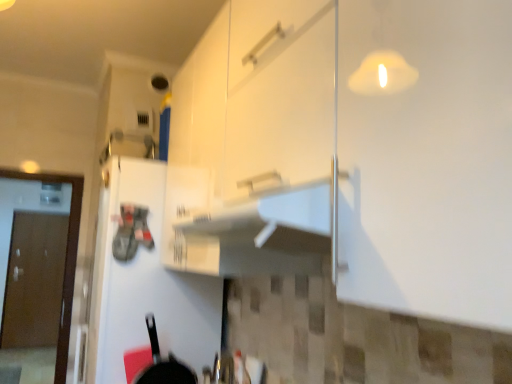
Question: From the image's perspective, is white matte refrigerator at left, the 2th door positioned from the back, on top of black matte frying pan at lower left?

Choices:
 (A) no
 (B) yes

Answer: (B)

Question: Is white matte refrigerator at left, which is the 1th door in front-to-back order, in contact with black matte frying pan at lower left?

Choices:
 (A) yes
 (B) no

Answer: (B)

Question: Considering the relative sizes of white matte refrigerator at left, positioned as the first door in right-to-left order, and black matte frying pan at lower left in the image provided, is white matte refrigerator at left, positioned as the first door in right-to-left order, taller than black matte frying pan at lower left?

Choices:
 (A) no
 (B) yes

Answer: (B)

Question: From the image's perspective, does white matte refrigerator at left, the 2th door positioned from the back, appear lower than black matte frying pan at lower left?

Choices:
 (A) yes
 (B) no

Answer: (B)

Question: Are white matte refrigerator at left, the 2th door positioned from the back, and black matte frying pan at lower left far apart?

Choices:
 (A) no
 (B) yes

Answer: (A)

Question: In terms of height, does white matte refrigerator at left, the 2th door positioned from the back, look taller or shorter compared to black matte frying pan at lower left?

Choices:
 (A) tall
 (B) short

Answer: (A)

Question: From the image's perspective, is white matte refrigerator at left, acting as the 2th door starting from the left, above or below black matte frying pan at lower left?

Choices:
 (A) below
 (B) above

Answer: (B)

Question: In the image, is white matte refrigerator at left, the 2th door positioned from the back, positioned in front of or behind black matte frying pan at lower left?

Choices:
 (A) front
 (B) behind

Answer: (B)

Question: Looking at the image, does white matte refrigerator at left, acting as the 2th door starting from the left, seem bigger or smaller compared to black matte frying pan at lower left?

Choices:
 (A) small
 (B) big

Answer: (B)

Question: Considering the positions of point (36, 345) and point (152, 324), is point (36, 345) closer or farther from the camera than point (152, 324)?

Choices:
 (A) closer
 (B) farther

Answer: (B)

Question: Is brown matte door at left, which is the 2th door in front-to-back order, to the left or to the right of black matte frying pan at lower left in the image?

Choices:
 (A) right
 (B) left

Answer: (B)

Question: Considering the positions of brown matte door at left, which is counted as the 1th door, starting from the back, and black matte frying pan at lower left in the image, is brown matte door at left, which is counted as the 1th door, starting from the back, taller or shorter than black matte frying pan at lower left?

Choices:
 (A) short
 (B) tall

Answer: (B)

Question: Based on their sizes in the image, would you say brown matte door at left, placed as the first door when sorted from left to right, is bigger or smaller than black matte frying pan at lower left?

Choices:
 (A) big
 (B) small

Answer: (A)

Question: Is white matte refrigerator at left, the 2th door positioned from the back, taller or shorter than brown matte door at left, which is counted as the 1th door, starting from the back?

Choices:
 (A) tall
 (B) short

Answer: (B)

Question: From the image's perspective, is white matte refrigerator at left, acting as the 2th door starting from the left, positioned above or below brown matte door at left, placed as the first door when sorted from left to right?

Choices:
 (A) below
 (B) above

Answer: (B)